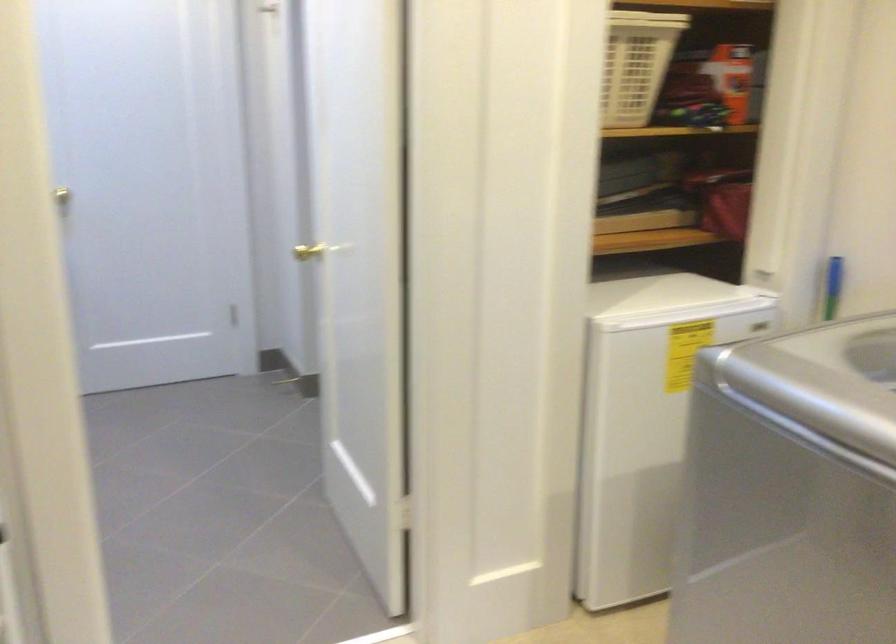
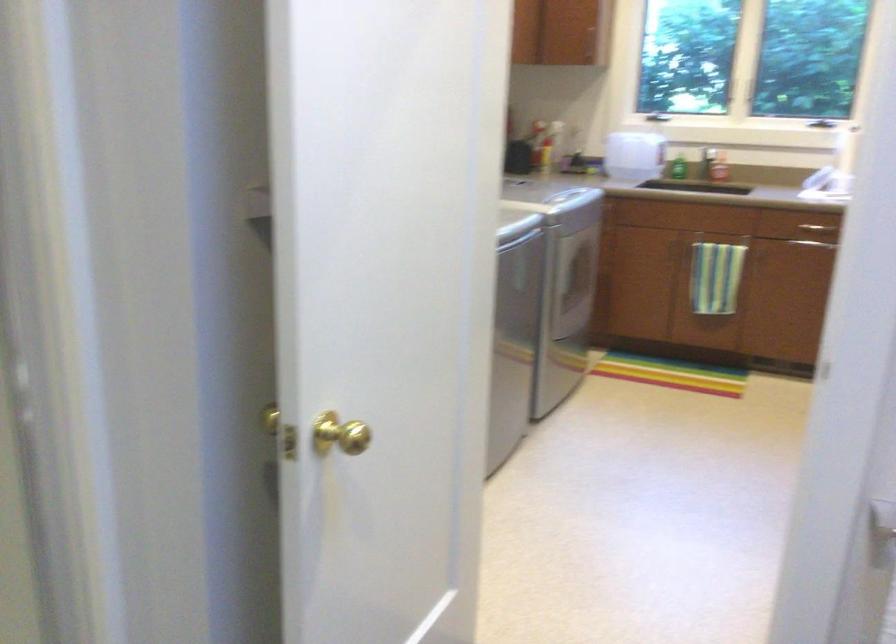
Question: I am providing you with two images of the same scene from different viewpoints. Which of the following objects are not visible in image2?

Choices:
 (A) orange box
 (B) black paper bag
 (C) gold door knob
 (D) green soap bottle

Answer: (A)